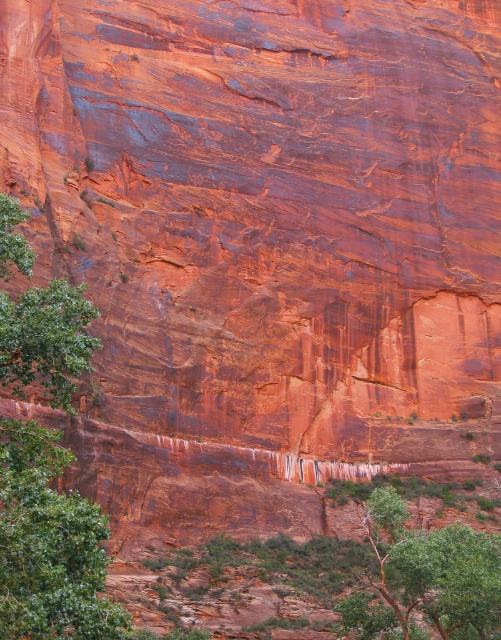
You are standing in the natural landscape looking at the massive reddish brown rock formation. You see a green leafy tree at left and a green leafy tree at lower center. Which tree is closer to you?

The green leafy tree at left is closer to you because it is in front of the green leafy tree at lower center.

From the picture: You are standing at the base of the massive reddish brown rock formation. You see two green leafy trees in the scene. Which tree is positioned higher up relative to the other? The options are the green leafy tree at left and the green leafy tree at lower center.

The green leafy tree at left is positioned higher up than the green leafy tree at lower center.